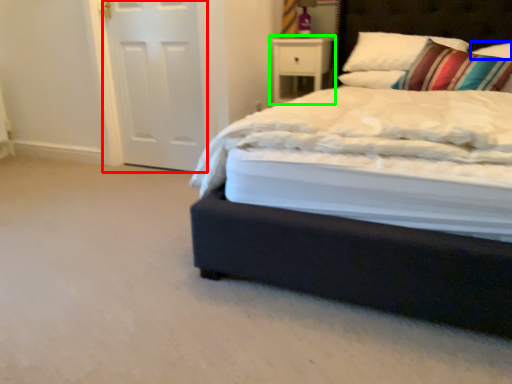
Question: Which object is positioned farthest from screen door (highlighted by a red box)? Select from pillow (highlighted by a blue box) and nightstand (highlighted by a green box).

Choices:
 (A) pillow
 (B) nightstand

Answer: (A)